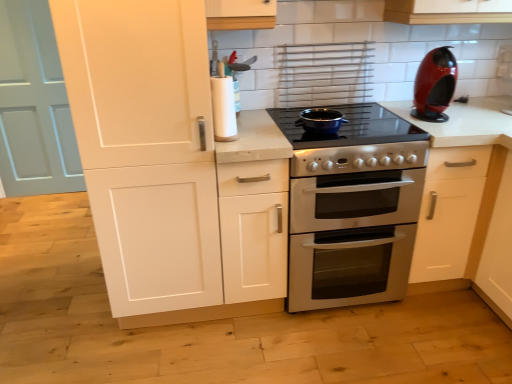
You are a GUI agent. You are given a task and a screenshot of the screen. Output one action in this format:
    pyautogui.click(x=<x>, y=<y>)
    Task: Click on the free point in front of white matte cabinet at left
    Image resolution: width=512 pixels, height=384 pixels.
    Given the screenshot: What is the action you would take?
    pyautogui.click(x=159, y=355)